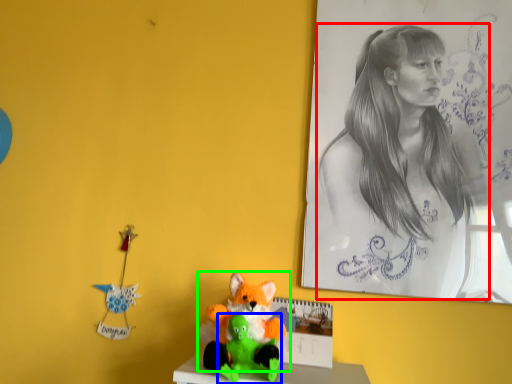
Question: Considering the real-world distances, which object is farthest from woman (highlighted by a red box)? toy (highlighted by a blue box) or toy (highlighted by a green box)?

Choices:
 (A) toy
 (B) toy

Answer: (A)